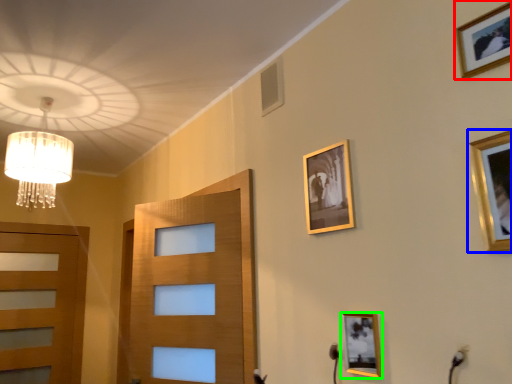
Question: Which object is the closest to the picture frame (highlighted by a red box)? Choose among these: picture frame (highlighted by a blue box) or picture frame (highlighted by a green box).

Choices:
 (A) picture frame
 (B) picture frame

Answer: (A)